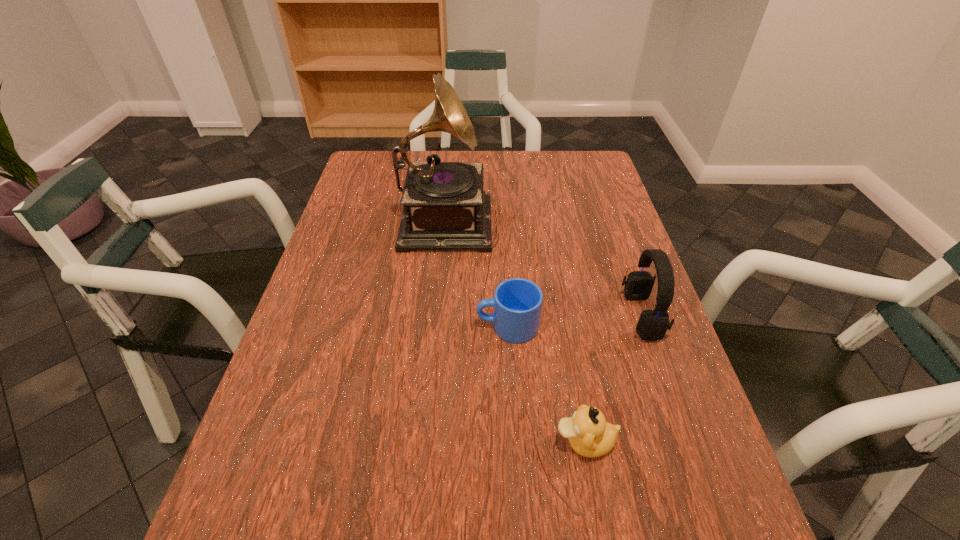
Locate an element on the screen. The width and height of the screenshot is (960, 540). object that is the third closest to the nearest object is located at coordinates pyautogui.click(x=445, y=207).

Identify which object is located as the nearest to the mug. Please provide its 2D coordinates. Your answer should be formatted as a tuple, i.e. [(x, y)], where the tuple contains the x and y coordinates of a point satisfying the conditions above.

[(589, 434)]